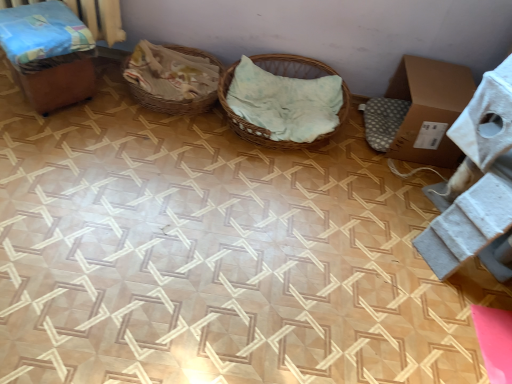
Where is `free spot above wooden box at left (from a real-world perspective)`? The width and height of the screenshot is (512, 384). free spot above wooden box at left (from a real-world perspective) is located at coordinates (37, 18).